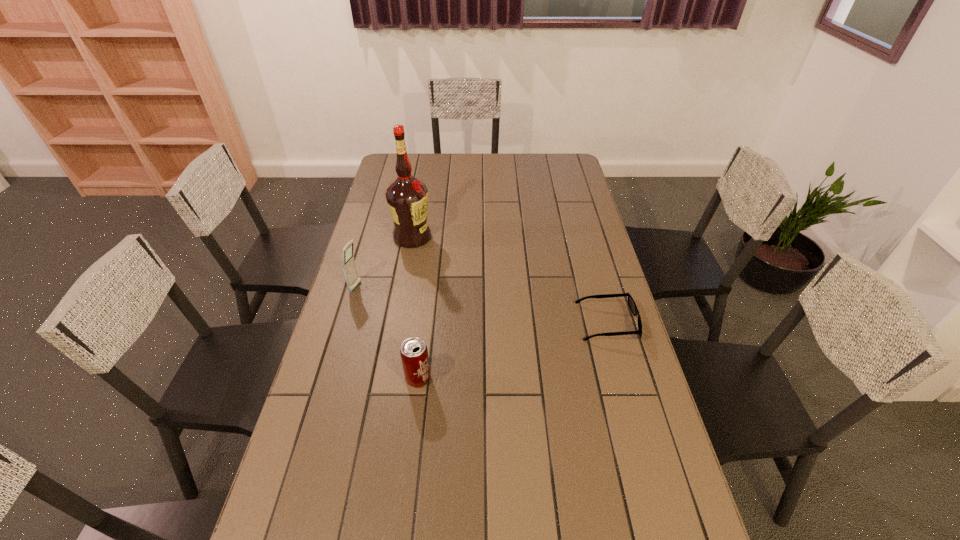
Where is `blank space that satisfies the following two spatial constraints: 1. on the front side of the farthest object; 2. on the front-facing side of the second nearest object`? The width and height of the screenshot is (960, 540). blank space that satisfies the following two spatial constraints: 1. on the front side of the farthest object; 2. on the front-facing side of the second nearest object is located at coordinates (396, 323).